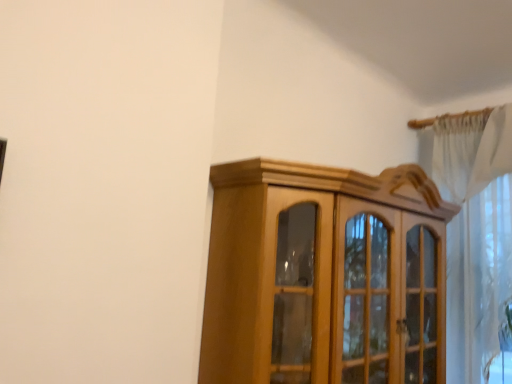
Question: Is light brown wood cabinet at center at the back of white sheer curtain at upper right?

Choices:
 (A) no
 (B) yes

Answer: (B)

Question: Does white sheer curtain at upper right have a greater width compared to light brown wood cabinet at center?

Choices:
 (A) no
 (B) yes

Answer: (A)

Question: From the image's perspective, is white sheer curtain at upper right beneath light brown wood cabinet at center?

Choices:
 (A) no
 (B) yes

Answer: (A)

Question: Is light brown wood cabinet at center located within white sheer curtain at upper right?

Choices:
 (A) yes
 (B) no

Answer: (B)

Question: From the image's perspective, is white sheer curtain at upper right above light brown wood cabinet at center?

Choices:
 (A) yes
 (B) no

Answer: (A)

Question: Is the position of white sheer curtain at upper right more distant than that of light brown wood cabinet at center?

Choices:
 (A) no
 (B) yes

Answer: (B)

Question: Is light brown wood cabinet at center further to the viewer compared to white sheer curtain at upper right?

Choices:
 (A) no
 (B) yes

Answer: (A)

Question: Does light brown wood cabinet at center have a greater height compared to white sheer curtain at upper right?

Choices:
 (A) no
 (B) yes

Answer: (A)

Question: Can you confirm if light brown wood cabinet at center is smaller than white sheer curtain at upper right?

Choices:
 (A) no
 (B) yes

Answer: (A)

Question: Is white sheer curtain at upper right completely or partially inside light brown wood cabinet at center?

Choices:
 (A) no
 (B) yes

Answer: (B)

Question: Does light brown wood cabinet at center have a greater width compared to white sheer curtain at upper right?

Choices:
 (A) no
 (B) yes

Answer: (B)

Question: From the image's perspective, is light brown wood cabinet at center on white sheer curtain at upper right?

Choices:
 (A) yes
 (B) no

Answer: (B)

Question: From their relative heights in the image, would you say white sheer curtain at upper right is taller or shorter than light brown wood cabinet at center?

Choices:
 (A) tall
 (B) short

Answer: (A)